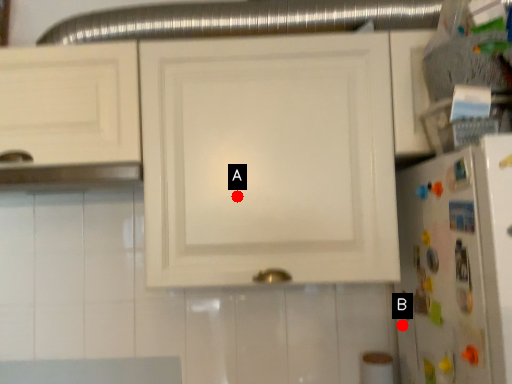
Question: Two points are circled on the image, labeled by A and B beside each circle. Which point appears farthest from the camera in this image?

Choices:
 (A) A is further
 (B) B is further

Answer: (B)